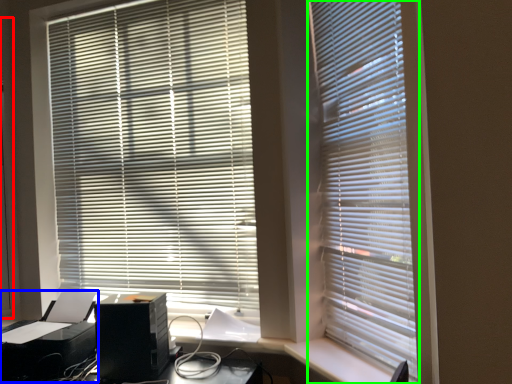
Question: Which object is the farthest from screen door (highlighted by a red box)? Choose among these: printer (highlighted by a blue box) or window blind (highlighted by a green box).

Choices:
 (A) printer
 (B) window blind

Answer: (B)